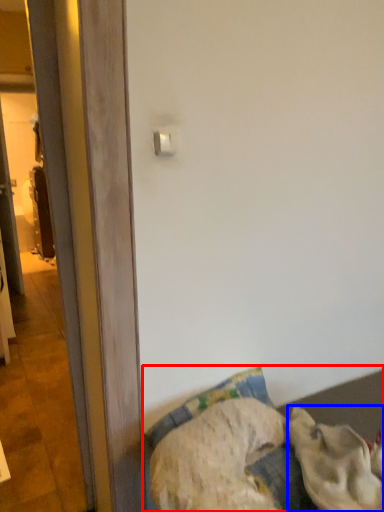
Question: Which object is closer to the camera taking this photo, furniture (highlighted by a red box) or animal (highlighted by a blue box)?

Choices:
 (A) furniture
 (B) animal

Answer: (A)